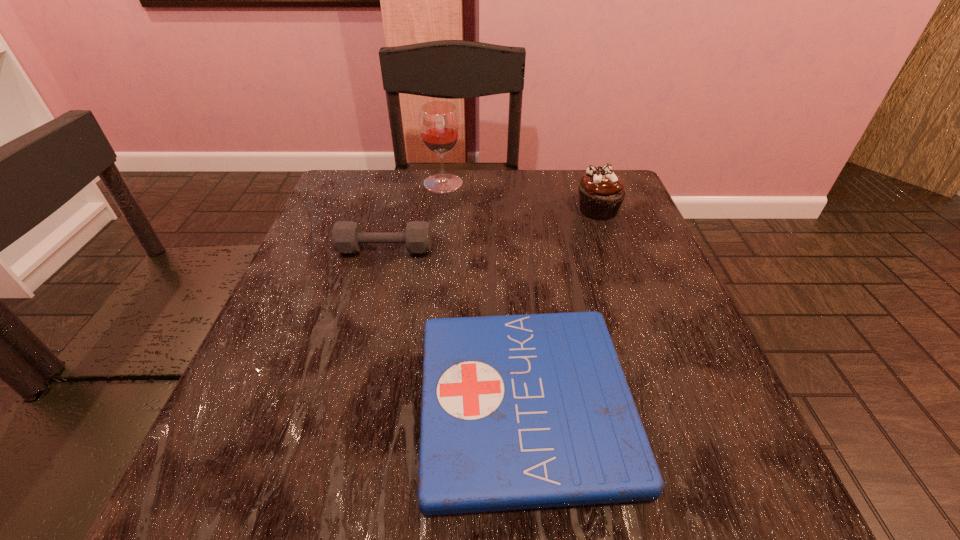
In the image, there is a desktop. Where is `blank space at the far edge`? blank space at the far edge is located at coordinates (523, 179).

Find the location of a particular element. vacant region at the left edge is located at coordinates (373, 261).

Identify the location of free region at the right edge of the desktop. (632, 382).

Locate an element on the screen. free spot at the near left corner of the desktop is located at coordinates (287, 484).

Where is `vacant space that's between the first-aid kit and the tallest object`? This screenshot has height=540, width=960. vacant space that's between the first-aid kit and the tallest object is located at coordinates (484, 293).

This screenshot has height=540, width=960. What are the coordinates of `vacant point located between the second shortest object and the tallest object` in the screenshot? It's located at (415, 217).

At what (x,y) coordinates should I click in order to perform the action: click on empty space that is in between the cupcake and the farthest object. Please return your answer as a coordinate pair (x, y). Looking at the image, I should click on (520, 197).

Locate an element on the screen. The height and width of the screenshot is (540, 960). vacant point located between the tallest object and the third tallest object is located at coordinates (415, 217).

You are a GUI agent. You are given a task and a screenshot of the screen. Output one action in this format:
    pyautogui.click(x=<x>, y=<y>)
    Task: Click on the vacant space that is in between the farthest object and the second nearest object
    The height and width of the screenshot is (540, 960).
    Given the screenshot: What is the action you would take?
    pyautogui.click(x=415, y=217)

Image resolution: width=960 pixels, height=540 pixels. I want to click on unoccupied position between the tallest object and the first-aid kit, so click(484, 293).